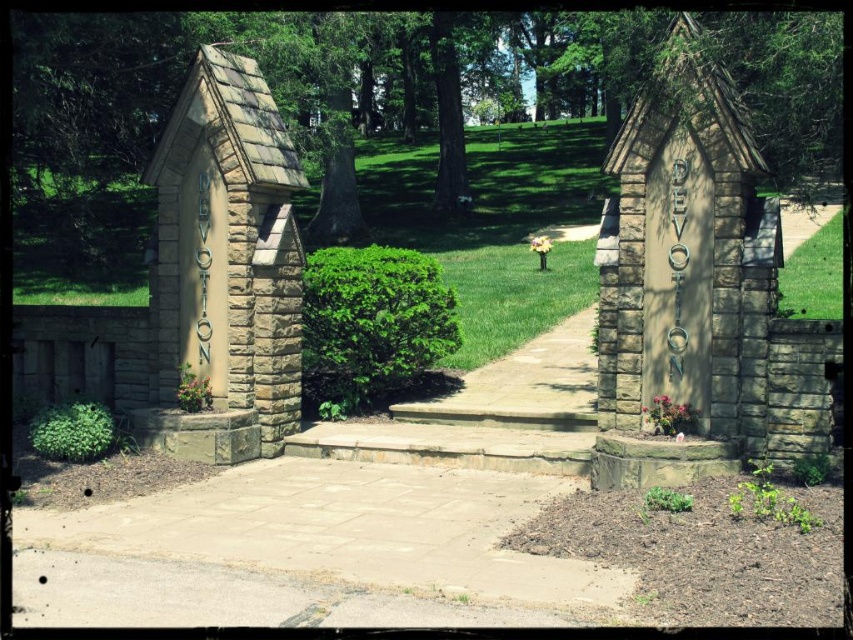
Who is taller, green leafy bush at center or green leafy hedge at lower left?

green leafy bush at center

Is green leafy bush at center bigger than green leafy hedge at lower left?

Indeed, green leafy bush at center has a larger size compared to green leafy hedge at lower left.

Where is `green leafy bush at center`? green leafy bush at center is located at coordinates (372, 323).

Based on the photo, is stone/rough textured chapel at right to the right of green leafy bush at center from the viewer's perspective?

Correct, you'll find stone/rough textured chapel at right to the right of green leafy bush at center.

Which is more to the left, stone/rough textured chapel at right or green leafy bush at center?

Positioned to the left is green leafy bush at center.

Locate an element on the screen. The height and width of the screenshot is (640, 853). stone/rough textured chapel at right is located at coordinates (683, 280).

Who is lower down, stone textured hut at left or green leafy hedge at lower left?

green leafy hedge at lower left

Can you confirm if stone textured hut at left is wider than green leafy hedge at lower left?

Indeed, stone textured hut at left has a greater width compared to green leafy hedge at lower left.

The width and height of the screenshot is (853, 640). I want to click on stone textured hut at left, so pyautogui.click(x=224, y=268).

Locate an element on the screen. stone textured hut at left is located at coordinates pyautogui.click(x=224, y=268).